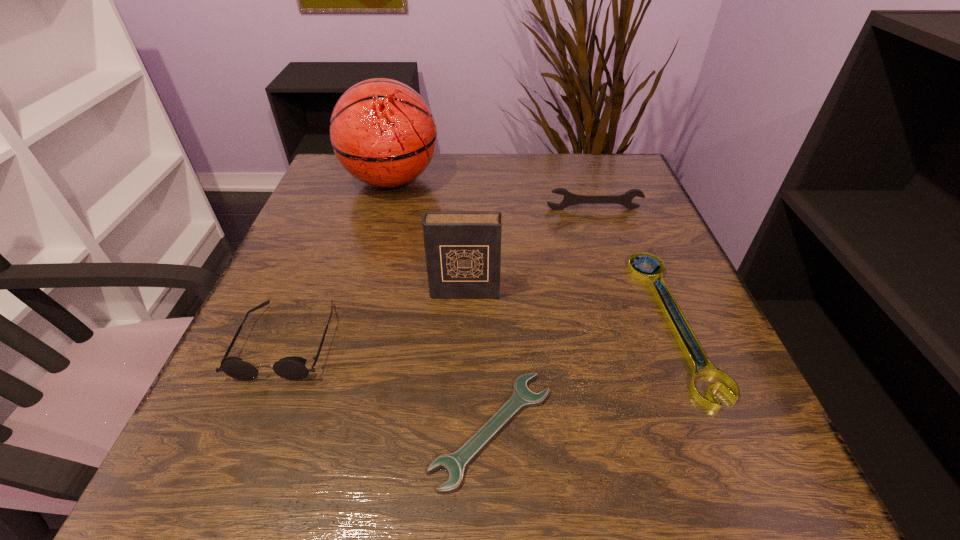
Locate an element on the screen. The image size is (960, 540). free spot between the shortest object and the fifth nearest object is located at coordinates (543, 319).

You are a GUI agent. You are given a task and a screenshot of the screen. Output one action in this format:
    pyautogui.click(x=<x>, y=<y>)
    Task: Click on the free space between the sunglasses and the diary
    The image size is (960, 540).
    Given the screenshot: What is the action you would take?
    pyautogui.click(x=375, y=316)

Identify the location of object that ranks as the fifth closest to the sunglasses. (647, 276).

At what (x,y) coordinates should I click in order to perform the action: click on the fifth closest object to the shortest wrench. Please return your answer as a coordinate pair (x, y). Looking at the image, I should click on (383, 133).

Locate which wrench ranks third in proximity to the tallest object. Please provide its 2D coordinates. Your answer should be formatted as a tuple, i.e. [(x, y)], where the tuple contains the x and y coordinates of a point satisfying the conditions above.

[(454, 464)]

Where is `the closest wrench relative to the sunglasses`? the closest wrench relative to the sunglasses is located at coordinates (454, 464).

Identify the location of vacant region that satisfies the following two spatial constraints: 1. on the open ends of the tallest wrench; 2. on the left side of the second shortest object. This screenshot has width=960, height=540. (631, 322).

Image resolution: width=960 pixels, height=540 pixels. I want to click on free spot that satisfies the following two spatial constraints: 1. on the back side of the shortest wrench; 2. on the side with spill of the basketball, so click(x=487, y=180).